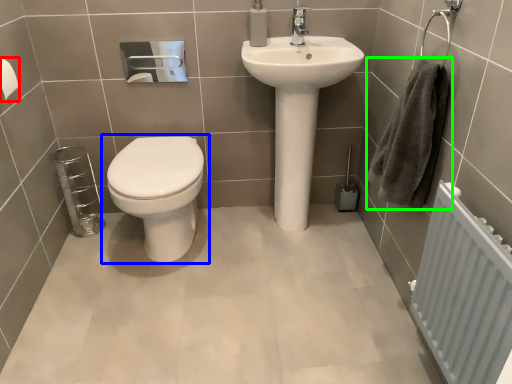
Question: Which object is the closest to the toilet paper (highlighted by a red box)? Choose among these: toilet (highlighted by a blue box) or hand towel (highlighted by a green box).

Choices:
 (A) toilet
 (B) hand towel

Answer: (A)